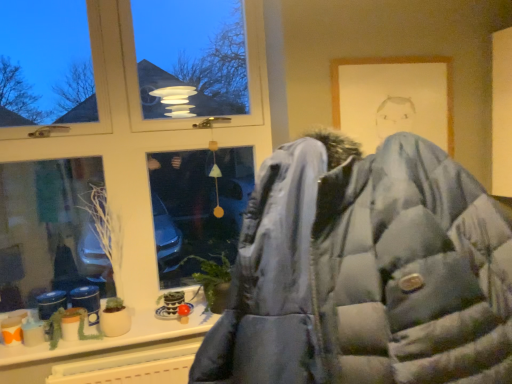
Question: Is matte white window at center further to camera compared to yellow plastic radiator at lower center?

Choices:
 (A) no
 (B) yes

Answer: (B)

Question: Is matte white window at center taller than yellow plastic radiator at lower center?

Choices:
 (A) no
 (B) yes

Answer: (B)

Question: Is matte white window at center with yellow plastic radiator at lower center?

Choices:
 (A) yes
 (B) no

Answer: (B)

Question: Is yellow plastic radiator at lower center at the back of matte white window at center?

Choices:
 (A) yes
 (B) no

Answer: (B)

Question: Considering the relative sizes of matte white window at center and yellow plastic radiator at lower center in the image provided, is matte white window at center shorter than yellow plastic radiator at lower center?

Choices:
 (A) yes
 (B) no

Answer: (B)

Question: Considering the relative positions of matte white window at center and yellow plastic radiator at lower center in the image provided, is matte white window at center to the right of yellow plastic radiator at lower center from the viewer's perspective?

Choices:
 (A) no
 (B) yes

Answer: (A)

Question: Is matte white window at center taller than white matte plant at lower left, the 1th plant positioned from the top?

Choices:
 (A) yes
 (B) no

Answer: (A)

Question: Is matte white window at center positioned with its back to white matte plant at lower left, the 2th plant ordered from the bottom?

Choices:
 (A) no
 (B) yes

Answer: (B)

Question: From a real-world perspective, is matte white window at center on top of white matte plant at lower left, the 1th plant positioned from the top?

Choices:
 (A) yes
 (B) no

Answer: (A)

Question: Would you say matte white window at center is outside white matte plant at lower left, the 1th plant positioned from the top?

Choices:
 (A) no
 (B) yes

Answer: (B)

Question: Is the position of matte white window at center less distant than that of white matte plant at lower left, the 1th plant positioned from the top?

Choices:
 (A) no
 (B) yes

Answer: (B)

Question: Can you confirm if matte white window at center is wider than white matte plant at lower left, the 2th plant ordered from the bottom?

Choices:
 (A) yes
 (B) no

Answer: (B)

Question: Considering the relative sizes of yellow plastic radiator at lower center and white matte plant at lower left, the 2th plant ordered from the bottom, in the image provided, is yellow plastic radiator at lower center thinner than white matte plant at lower left, the 2th plant ordered from the bottom,?

Choices:
 (A) no
 (B) yes

Answer: (B)